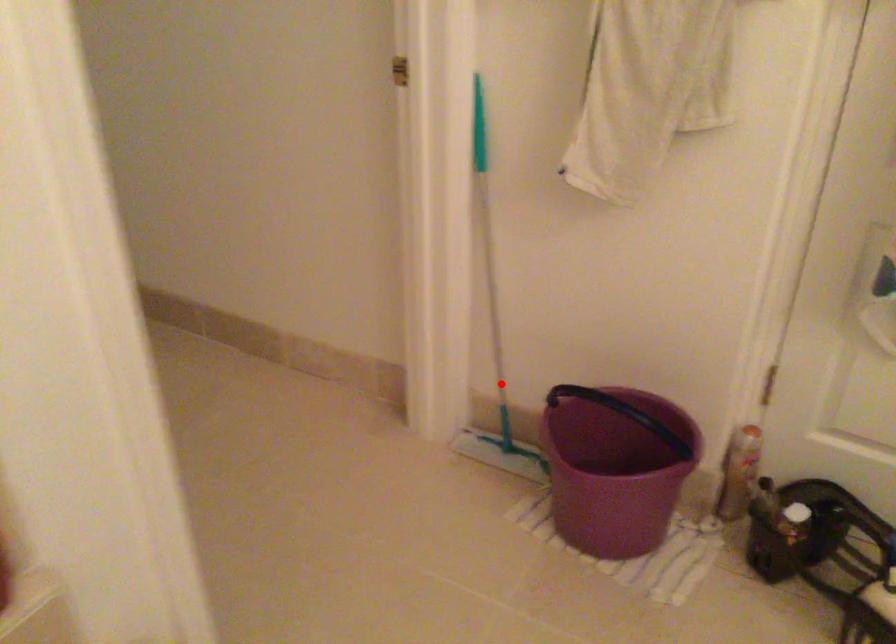
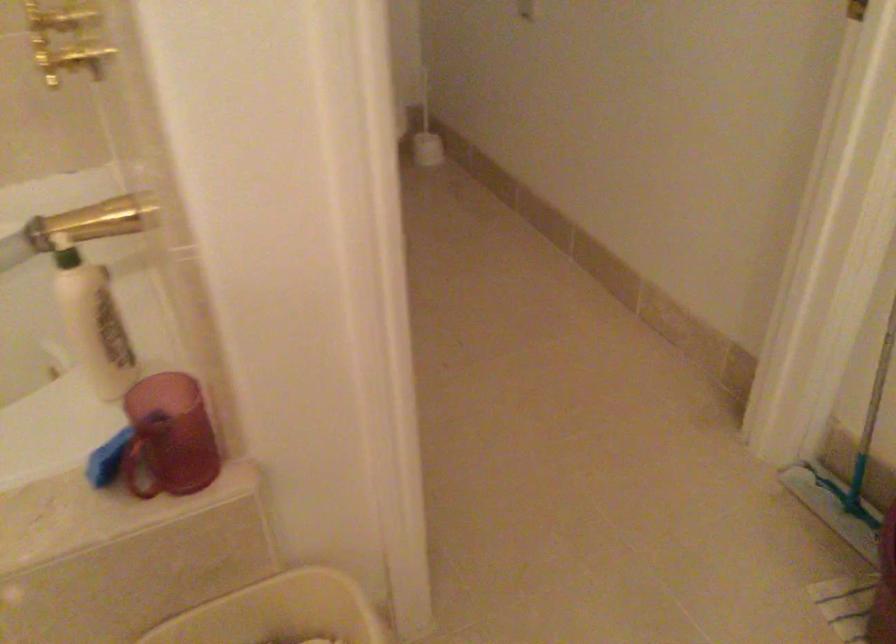
Question: I am providing you with two images of the same scene from different viewpoints. In image1, a red point is highlighted. Considering the same 3D point in image2, which of the following is correct?

Choices:
 (A) It is closer
 (B) It is farther

Answer: (A)